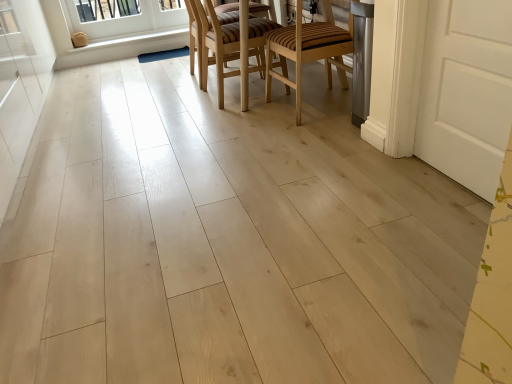
This screenshot has height=384, width=512. In order to click on vacant area situated below white wood window at upper left (from a real-world perspective) in this screenshot , I will do `click(147, 34)`.